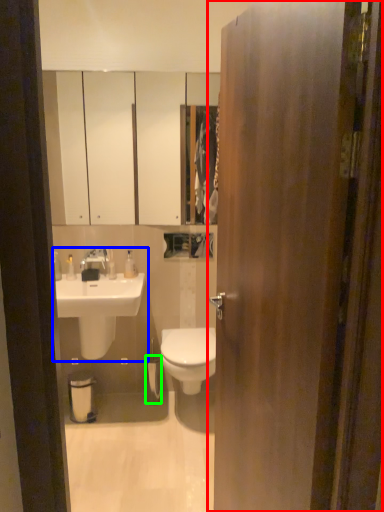
Question: Estimate the real-world distances between objects in this image. Which object is farther from door (highlighted by a red box), sink (highlighted by a blue box) or toilet paper (highlighted by a green box)?

Choices:
 (A) sink
 (B) toilet paper

Answer: (B)